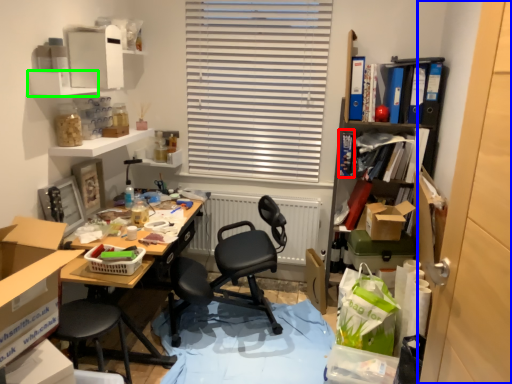
Question: Which object is the farthest from book (highlighted by a red box)? Choose among these: screen door (highlighted by a blue box) or shelf (highlighted by a green box).

Choices:
 (A) screen door
 (B) shelf

Answer: (A)